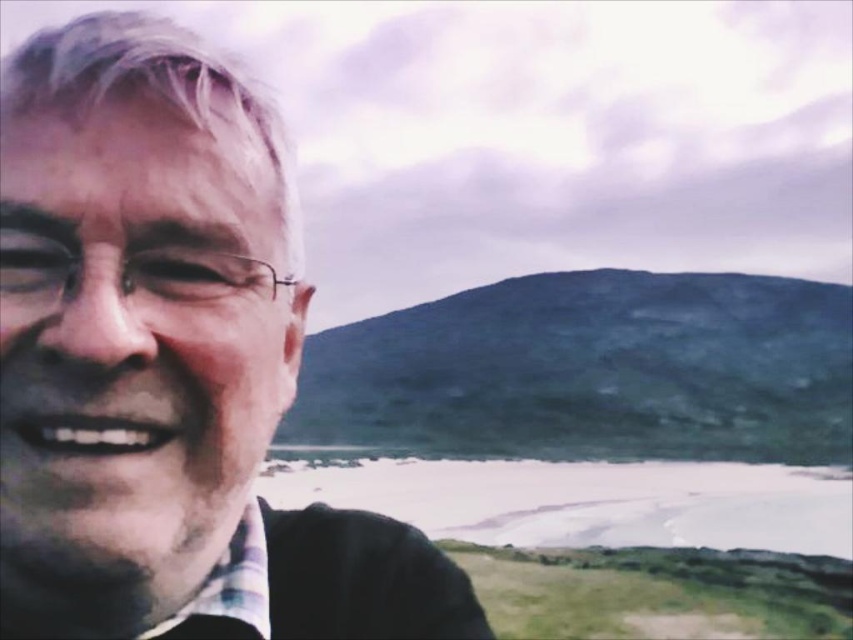
You are a photographer trying to frame a shot. You have to decide whether to focus on the matte black face at left or the plaid fabric shirt at lower left. Based on their sizes, which object should you prioritize in your composition to ensure it stands out more?

The matte black face at left has a larger width than the plaid fabric shirt at lower left, so prioritizing the matte black face at left in the composition will make it stand out more due to its greater size.

You are a photographer standing in front of the scene. You want to take a photo of the matte black face at left without including the background landscape. Based on the distance, can you achieve this with a standard camera lens that has a focal length of 50mm?

The matte black face at left is 1.39 meters away from the viewer. With a standard 50mm lens, which has a moderate field of view, you can likely frame the shot to capture just the matte black face at left while excluding the background landscape by adjusting your position and zoom.

You are a photographer reviewing this image. You notice the matte black face at left and the plaid fabric shirt at lower left. Which object is positioned more to the left in the image?

The matte black face at left is positioned more to the left than the plaid fabric shirt at lower left.